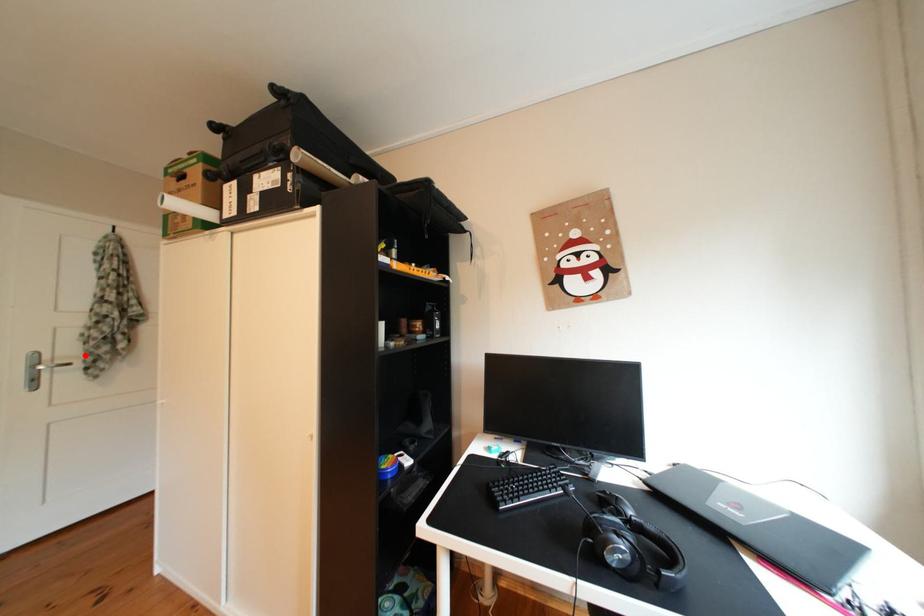
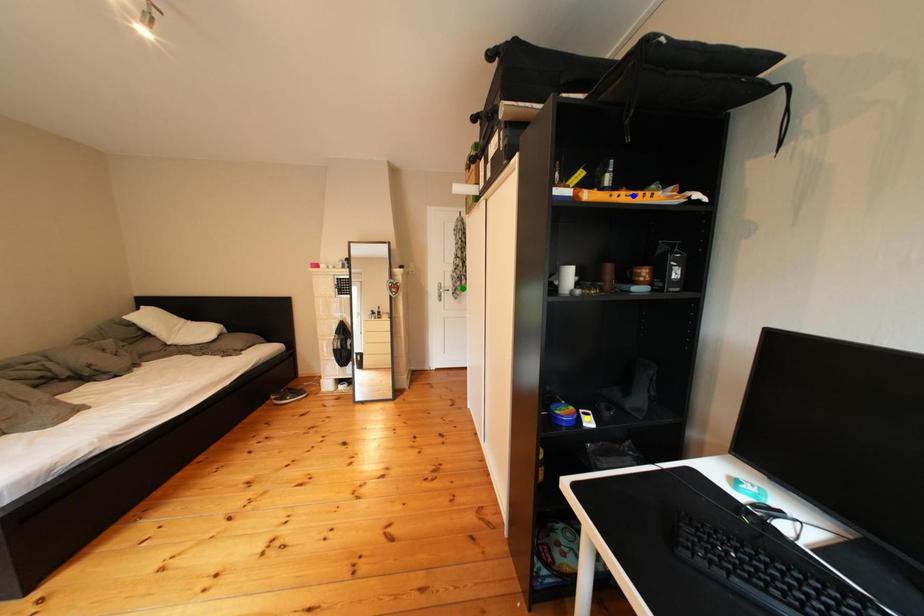
Question: I am providing you with two images of the same scene from different viewpoints. A red point is marked on the first image. You are given multiple points on the second image. Which point in image 2 is actually the same real-world point as the red point in image 1?

Choices:
 (A) blue point
 (B) green point
 (C) yellow point

Answer: (B)